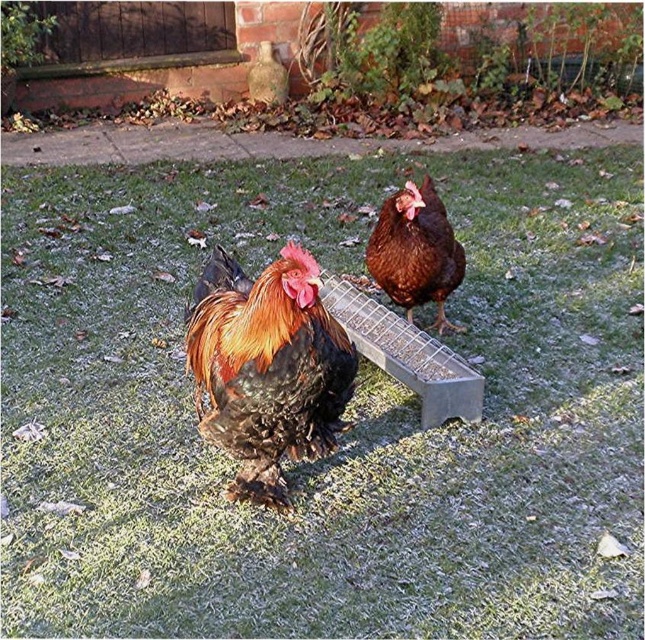
Looking at this image, can you confirm if shiny brown rooster at center is shorter than brown matte chicken at center?

Incorrect, shiny brown rooster at center's height does not fall short of brown matte chicken at center's.

Is shiny brown rooster at center below brown matte chicken at center?

Yes.

Which is behind, point (263, 422) or point (457, 253)?

Positioned behind is point (457, 253).

Find the location of a particular element. This screenshot has width=645, height=640. shiny brown rooster at center is located at coordinates (268, 368).